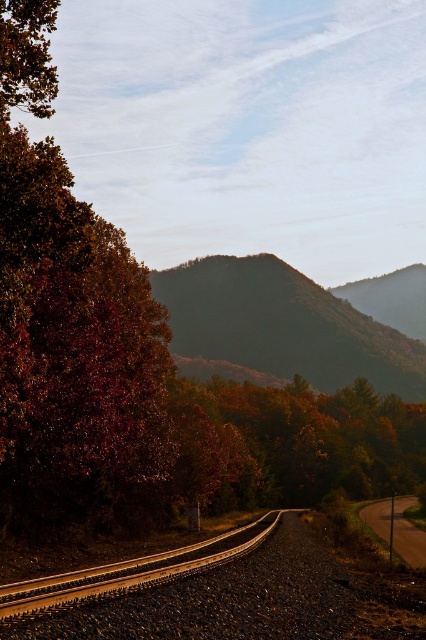
You are a hiker who wants to cross the brown gravel track at center. There are autumn leaves at center blocking the path. Can you step over them?

The autumn leaves at center are much taller than the brown gravel track at center, so yes, you can step over them easily.

You are standing at the edge of the green matte hillside at center and want to pick up the autumn leaves at center. Can you reach them without crossing the hillside?

The autumn leaves at center is behind the green matte hillside at center, so you cannot reach them without crossing the hillside.

You are standing at the center of the image and see the green matte hillside at center and autumn leaves at center. Which object is positioned to the right of the other?

The green matte hillside at center is to the right of autumn leaves at center.